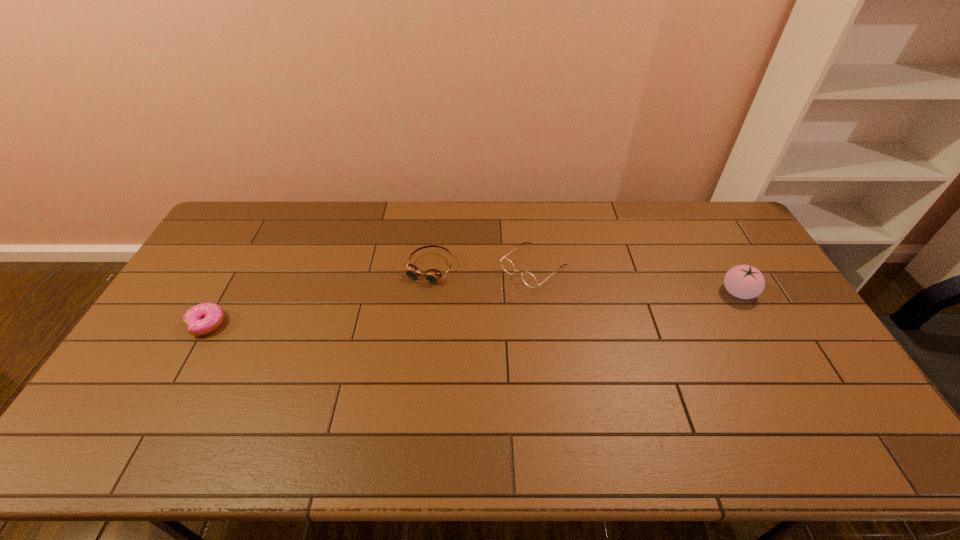
Locate an element on the screen. The width and height of the screenshot is (960, 540). the nearest object is located at coordinates (204, 318).

Where is `the leftmost object`? The image size is (960, 540). the leftmost object is located at coordinates (204, 318).

At what (x,y) coordinates should I click in order to perform the action: click on tomato. Please return your answer as a coordinate pair (x, y). This screenshot has width=960, height=540. Looking at the image, I should click on (743, 281).

This screenshot has height=540, width=960. I want to click on the tallest object, so click(743, 281).

Locate an element on the screen. The height and width of the screenshot is (540, 960). spectacles is located at coordinates (529, 279).

Image resolution: width=960 pixels, height=540 pixels. Find the location of `the third shortest object`. the third shortest object is located at coordinates (529, 279).

I want to click on goggles, so click(432, 275).

This screenshot has height=540, width=960. I want to click on free space located 0.190m on the back of the doughnut, so click(x=239, y=267).

At what (x,y) coordinates should I click in order to perform the action: click on free region located on the front of the tomato. Please return your answer as a coordinate pair (x, y). This screenshot has width=960, height=540. Looking at the image, I should click on (789, 382).

Find the location of `free space located 0.190m on the front-facing side of the second tallest object`. free space located 0.190m on the front-facing side of the second tallest object is located at coordinates (469, 318).